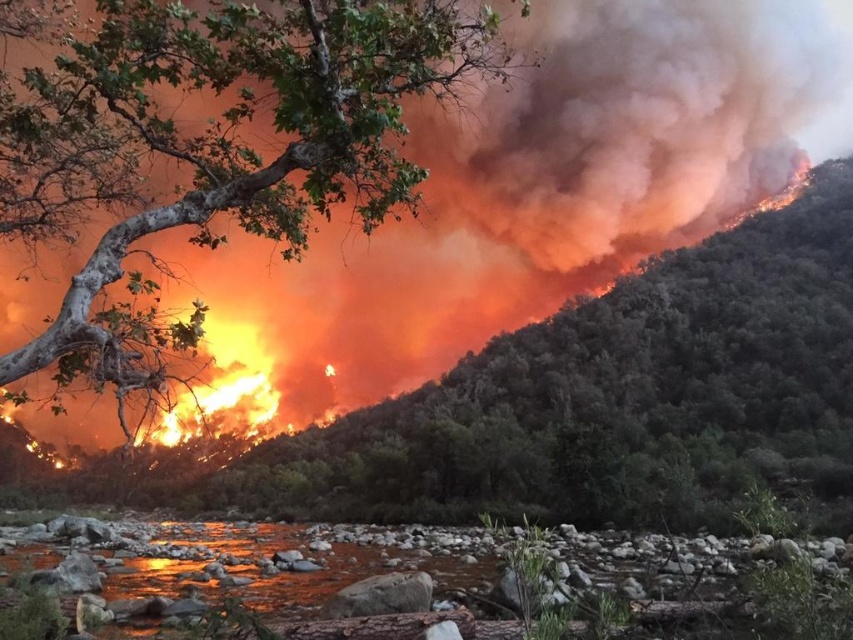
Question: Can you confirm if green leafy tree at center is positioned above green leafy tree at upper left?

Choices:
 (A) no
 (B) yes

Answer: (B)

Question: Which of the following is the closest to the observer?

Choices:
 (A) green leafy tree at upper left
 (B) green leafy tree at center

Answer: (A)

Question: Which object is closer to the camera taking this photo?

Choices:
 (A) green leafy tree at center
 (B) green leafy tree at upper left

Answer: (B)

Question: Does green leafy tree at center have a greater width compared to green leafy tree at upper left?

Choices:
 (A) no
 (B) yes

Answer: (B)

Question: Is green leafy tree at center positioned before green leafy tree at upper left?

Choices:
 (A) yes
 (B) no

Answer: (B)

Question: Among these points, which one is nearest to the camera?

Choices:
 (A) (540, 467)
 (B) (372, 160)

Answer: (B)